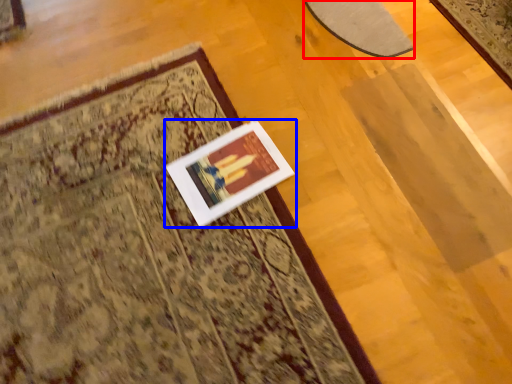
Question: Which of the following is the farthest to the observer, mat (highlighted by a red box) or picture frame (highlighted by a blue box)?

Choices:
 (A) mat
 (B) picture frame

Answer: (A)